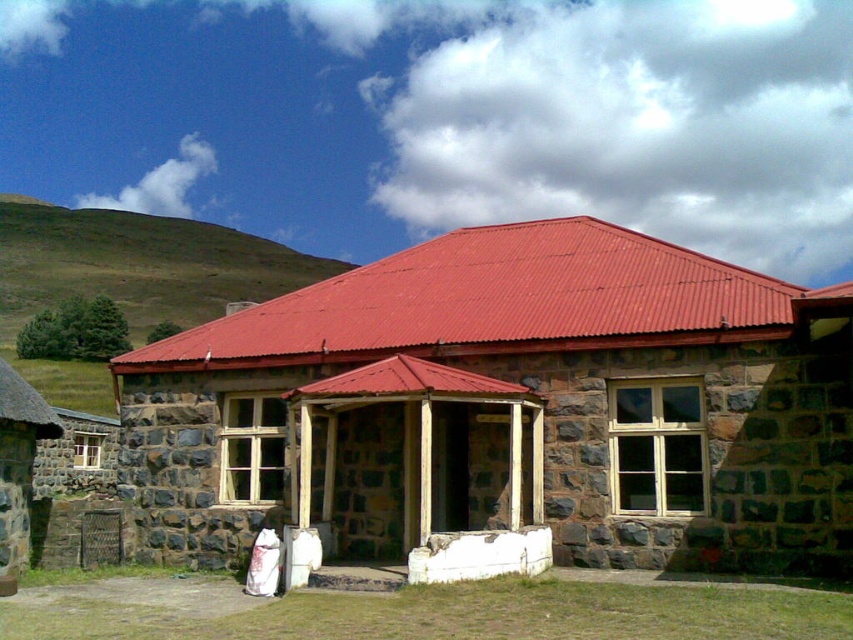
You are standing at the dirt path in front of the stone textured hut at center and want to climb up to the green grassy hill at upper left. Which direction should you walk to reach the hill?

The stone textured hut at center is positioned under the green grassy hill at upper left, so you should walk towards the upper left direction to reach the hill.